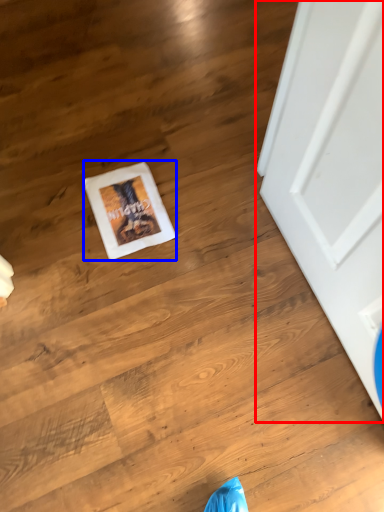
Question: Which point is further to the camera, door (highlighted by a red box) or postcard (highlighted by a blue box)?

Choices:
 (A) door
 (B) postcard

Answer: (B)